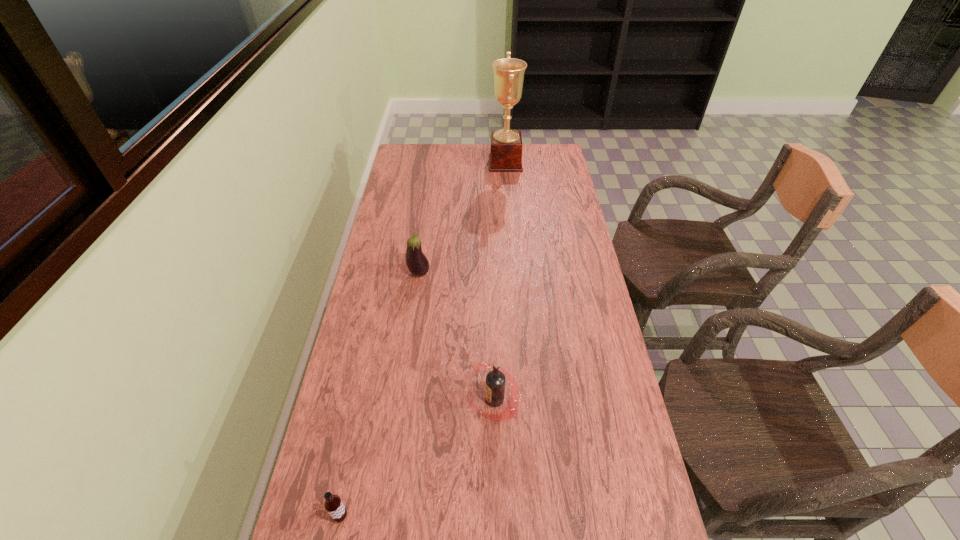
The width and height of the screenshot is (960, 540). I want to click on vacant space that is in between the farther root beer and the second farthest object, so click(457, 336).

Find the location of a particular element. blank region between the trophy cup and the shorter root beer is located at coordinates (423, 340).

I want to click on unoccupied position between the second farthest object and the third farthest object, so click(x=457, y=336).

This screenshot has width=960, height=540. What are the coordinates of `empty location between the right root beer and the trophy cup` in the screenshot? It's located at (500, 281).

Find the location of a particular element. This screenshot has width=960, height=540. object identified as the third closest to the nearer root beer is located at coordinates (506, 146).

Identify which object is located as the third nearest to the taller root beer. Please provide its 2D coordinates. Your answer should be formatted as a tuple, i.e. [(x, y)], where the tuple contains the x and y coordinates of a point satisfying the conditions above.

[(506, 146)]